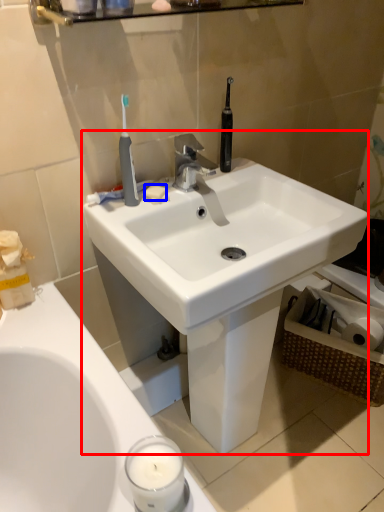
Question: Among these objects, which one is nearest to the camera, sink (highlighted by a red box) or soap (highlighted by a blue box)?

Choices:
 (A) sink
 (B) soap

Answer: (A)